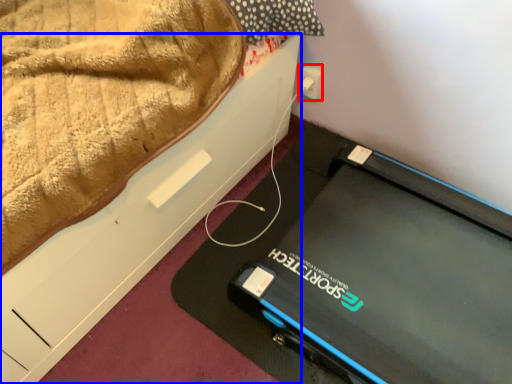
Question: Which of the following is the closest to the observer, electric outlet (highlighted by a red box) or furniture (highlighted by a blue box)?

Choices:
 (A) electric outlet
 (B) furniture

Answer: (B)